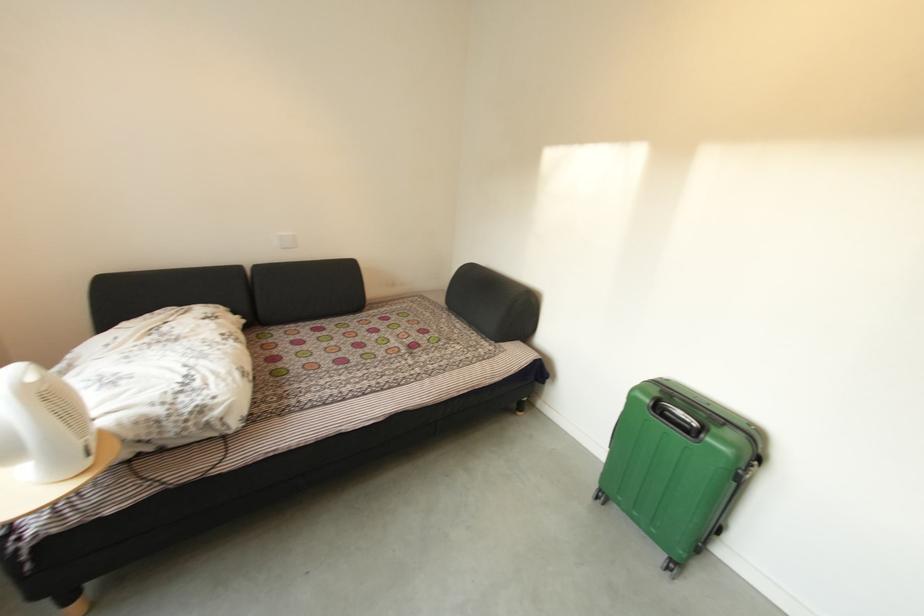
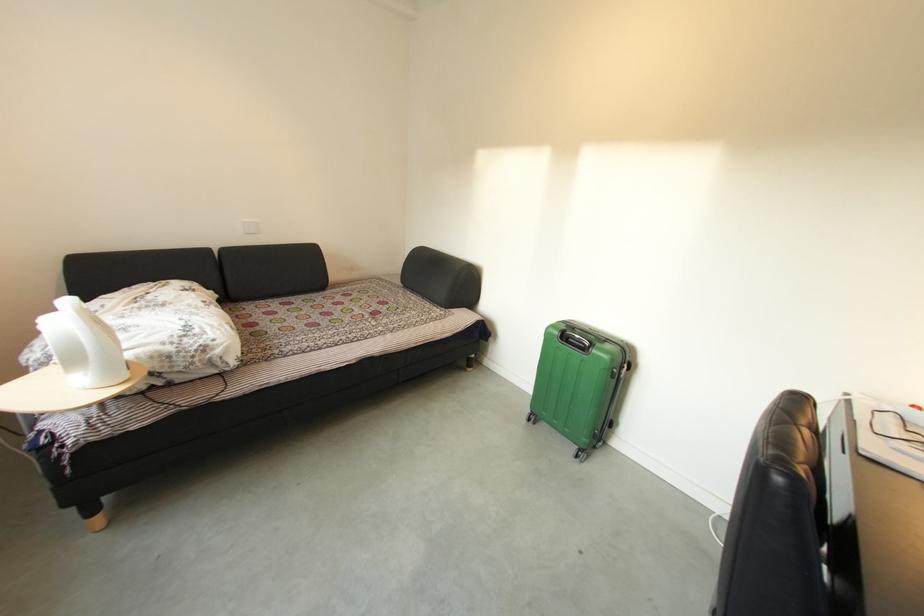
Where in the second image is the point corresponding to pixel 451 309 from the first image?

(407, 286)